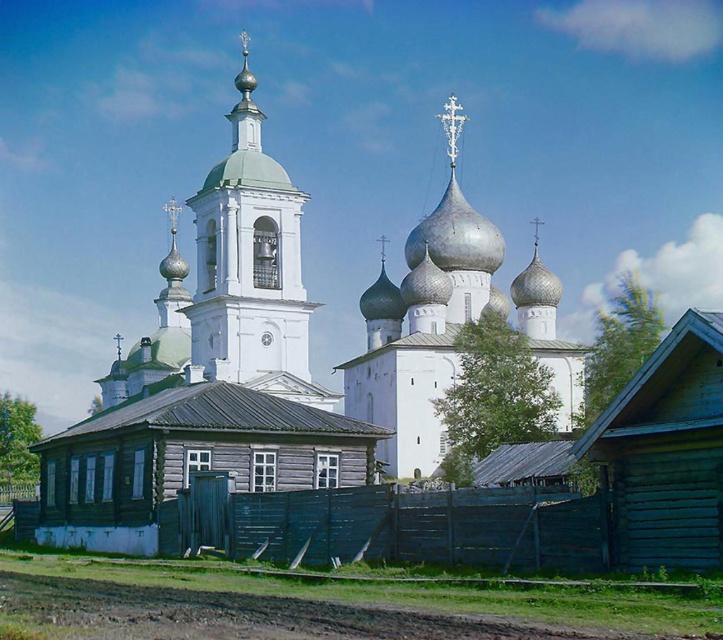
Does point (393, 506) come farther from viewer compared to point (239, 134)?

No.

Who is positioned more to the left, blue wooden fence at lower center or white stone bell tower at center?

Positioned to the left is white stone bell tower at center.

Locate an element on the screen. This screenshot has width=723, height=640. blue wooden fence at lower center is located at coordinates (390, 525).

Does white stone church at center have a lesser height compared to white stone bell tower at center?

Yes.

Does white stone church at center have a greater height compared to white stone bell tower at center?

No.

Which is behind, point (551, 330) or point (254, 289)?

Point (551, 330)

Where is `white stone church at center`? The width and height of the screenshot is (723, 640). white stone church at center is located at coordinates (423, 323).

Looking at this image, is blue wooden fence at lower center smaller than white stone church at center?

Correct, blue wooden fence at lower center occupies less space than white stone church at center.

Is point (278, 506) behind point (395, 301)?

No, it is in front of (395, 301).

Identify the location of blue wooden fence at lower center. The width and height of the screenshot is (723, 640). (390, 525).